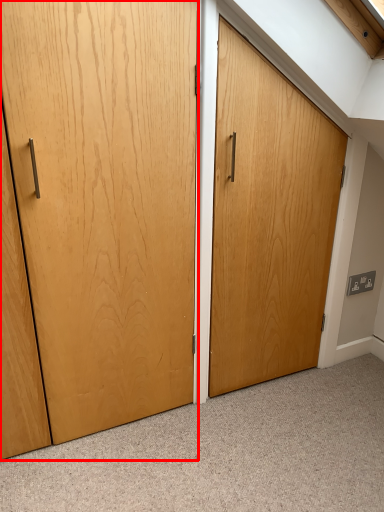
Question: From the image's perspective, what is the correct spatial relationship of door (annotated by the red box) in relation to electric outlet?

Choices:
 (A) below
 (B) above

Answer: (B)